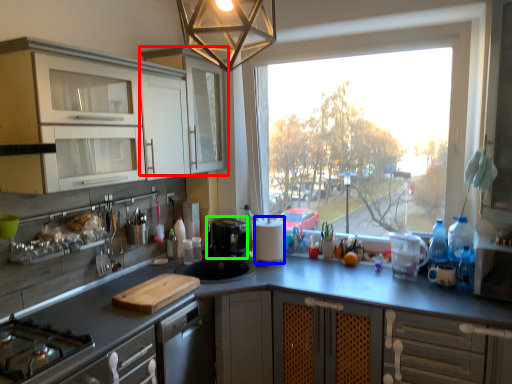
Question: Considering the real-world distances, which object is closest to cabinetry (highlighted by a red box)? paper towel (highlighted by a blue box) or coffee machine (highlighted by a green box).

Choices:
 (A) paper towel
 (B) coffee machine

Answer: (B)